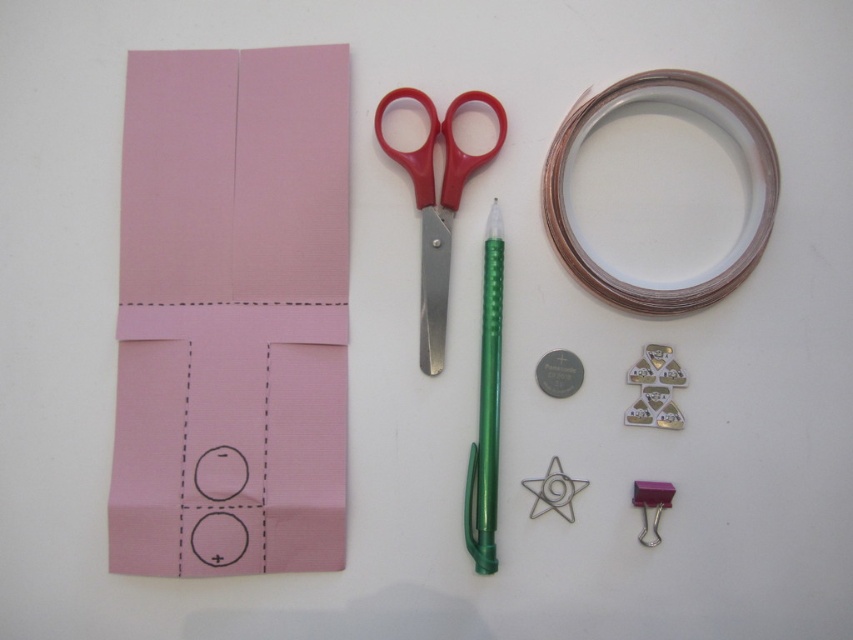
You are an art student who needs to cut the pink paper at left using the red plastic scissors at center. Can the scissors reach the entire height of the paper?

The pink paper at left is much taller than the red plastic scissors at center, so the scissors may not be able to reach the entire height of the paper when cutting.